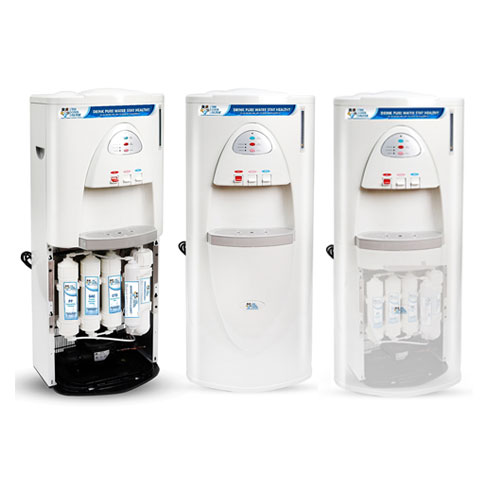
Find the location of a particular element. water machine is located at coordinates (118, 210), (233, 215), (402, 212).